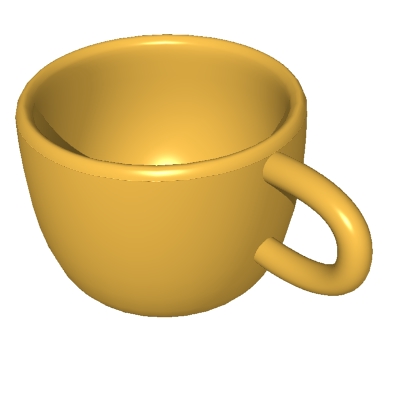
You are a GUI agent. You are given a task and a screenshot of the screen. Output one action in this format:
    pyautogui.click(x=<x>, y=<y>)
    Task: Click on the drinking utensil
    This screenshot has width=400, height=400.
    Given the screenshot: What is the action you would take?
    pyautogui.click(x=142, y=83)